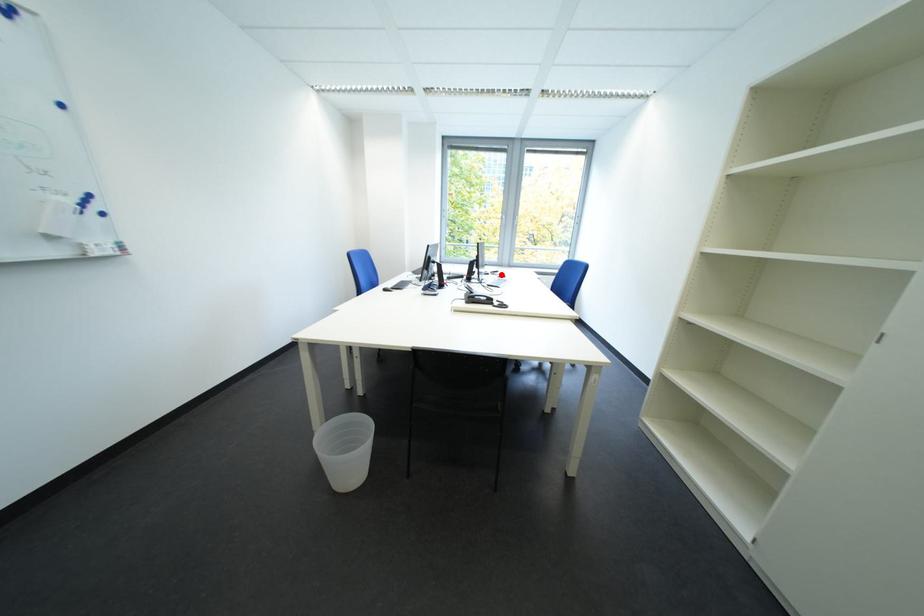
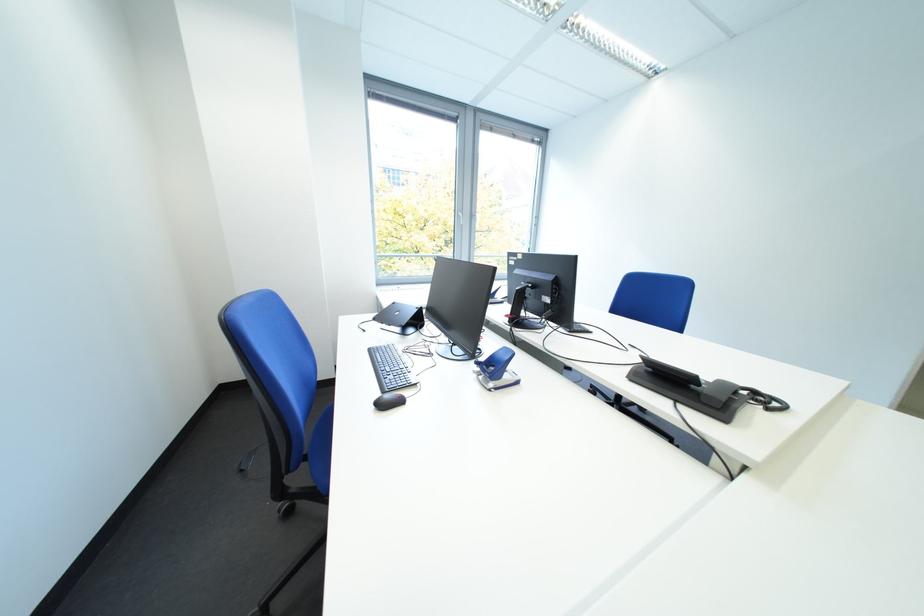
Question: I am providing you with two images of the same scene from different viewpoints. A red point is marked on the first image. Can you still see the location of the red point in image 2?

Choices:
 (A) Yes
 (B) No

Answer: (B)